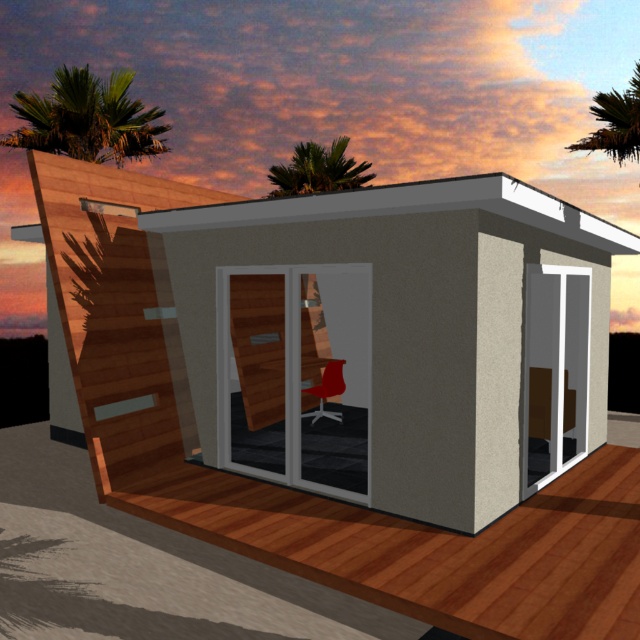
Question: Which of the following is the closest to the observer?

Choices:
 (A) (122, 154)
 (B) (355, 173)
 (C) (611, 106)
 (D) (92, 301)

Answer: (D)

Question: From the image, what is the correct spatial relationship of green leafy palm tree at upper left in relation to green leafy palm tree at upper center?

Choices:
 (A) above
 (B) below

Answer: (A)

Question: Based on their relative distances, which object is nearer to the green leafy palm tree at upper right?

Choices:
 (A) green leafy palm tree at upper center
 (B) green leafy palm tree at upper left
 (C) wooden hut at center

Answer: (A)

Question: Does wooden hut at center appear on the left side of green leafy palm tree at upper center?

Choices:
 (A) yes
 (B) no

Answer: (A)

Question: Which point is farther to the camera?

Choices:
 (A) green leafy palm tree at upper right
 (B) green leafy palm tree at upper center
 (C) wooden hut at center

Answer: (B)

Question: Can you confirm if green leafy palm tree at upper left is smaller than green leafy palm tree at upper center?

Choices:
 (A) no
 (B) yes

Answer: (A)